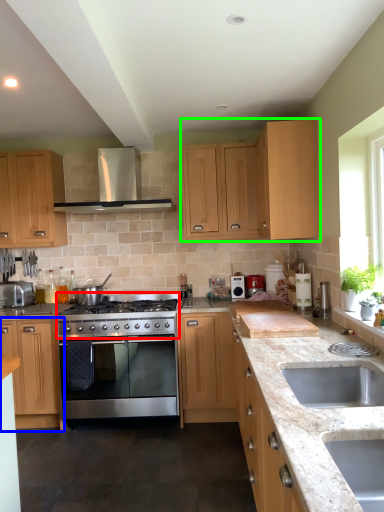
Question: Estimate the real-world distances between objects in this image. Which object is closer to gas stove (highlighted by a red box), cabinetry (highlighted by a blue box) or cabinetry (highlighted by a green box)?

Choices:
 (A) cabinetry
 (B) cabinetry

Answer: (A)